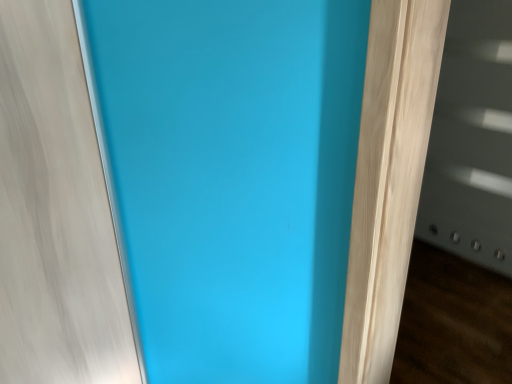
Image resolution: width=512 pixels, height=384 pixels. What are the coordinates of `clear glass door at right` in the screenshot? It's located at click(472, 139).

This screenshot has height=384, width=512. What do you see at coordinates (472, 139) in the screenshot?
I see `clear glass door at right` at bounding box center [472, 139].

At what (x,y) coordinates should I click in order to perform the action: click on clear glass door at right. Please return your answer as a coordinate pair (x, y). The height and width of the screenshot is (384, 512). Looking at the image, I should click on (472, 139).